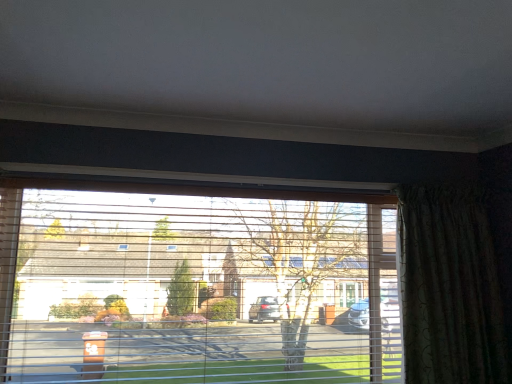
Question: Considering their positions, is green textured curtain at right located in front of or behind transparent plastic window at center?

Choices:
 (A) front
 (B) behind

Answer: (B)

Question: Based on their positions, is green textured curtain at right located to the left or right of transparent plastic window at center?

Choices:
 (A) left
 (B) right

Answer: (B)

Question: From the image's perspective, is green textured curtain at right above or below transparent plastic window at center?

Choices:
 (A) below
 (B) above

Answer: (B)

Question: Is point (32, 301) closer or farther from the camera than point (432, 362)?

Choices:
 (A) closer
 (B) farther

Answer: (A)

Question: Would you say transparent plastic window at center is inside or outside green textured curtain at right?

Choices:
 (A) inside
 (B) outside

Answer: (B)

Question: From a real-world perspective, is transparent plastic window at center positioned above or below green textured curtain at right?

Choices:
 (A) above
 (B) below

Answer: (B)

Question: Is transparent plastic window at center taller or shorter than green textured curtain at right?

Choices:
 (A) short
 (B) tall

Answer: (B)